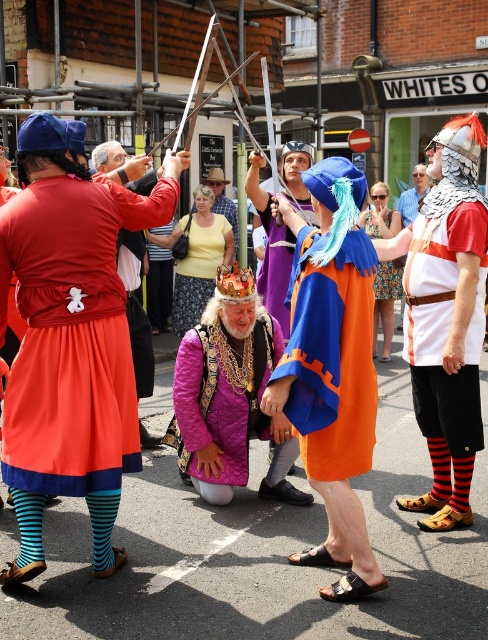
Which is behind, point (258, 280) or point (220, 193)?

Point (220, 193)

Between orange felt cape at center and yellow cotton shirt at center, which one appears on the left side from the viewer's perspective?

Positioned to the left is yellow cotton shirt at center.

Is point (313, 221) farther from viewer compared to point (234, 221)?

No, (313, 221) is closer to viewer.

Image resolution: width=488 pixels, height=640 pixels. Find the location of `orange felt cape at center`. orange felt cape at center is located at coordinates (276, 268).

Is point (340, 384) positioned before point (234, 237)?

Yes, point (340, 384) is in front of point (234, 237).

Who is more distant from viewer, (342, 266) or (236, 230)?

The point (236, 230) is behind.

Is point (296, 340) behind point (235, 205)?

No, it is in front of (235, 205).

The image size is (488, 640). I want to click on orange fabric cape at center, so click(331, 356).

Which is more to the right, matte red cape at left or yellow cotton shirt at center?

From the viewer's perspective, yellow cotton shirt at center appears more on the right side.

Is matte red cape at left behind yellow cotton shirt at center?

No.

Who is more distant from viewer, (133, 337) or (238, 248)?

The point (238, 248) is behind.

This screenshot has width=488, height=640. I want to click on matte red cape at left, so click(x=137, y=307).